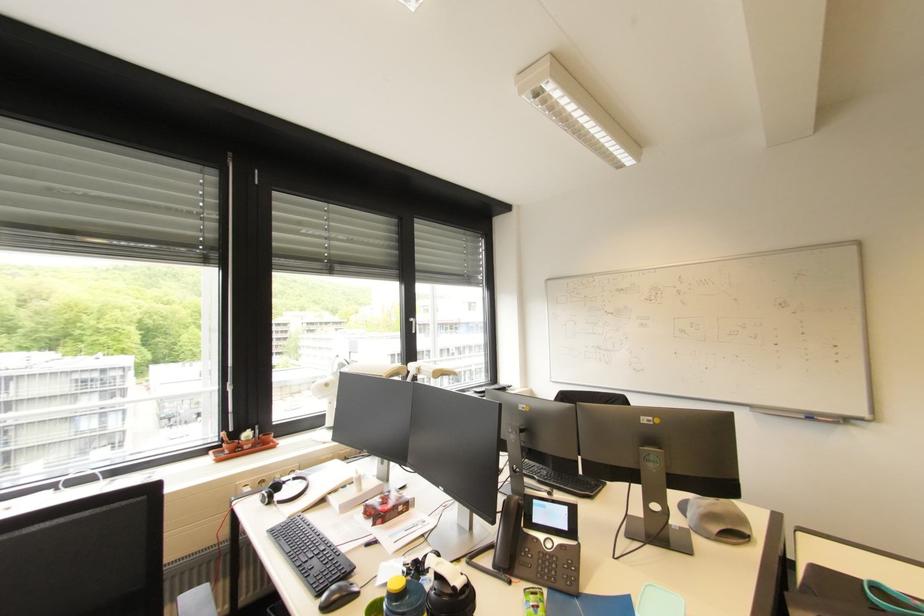
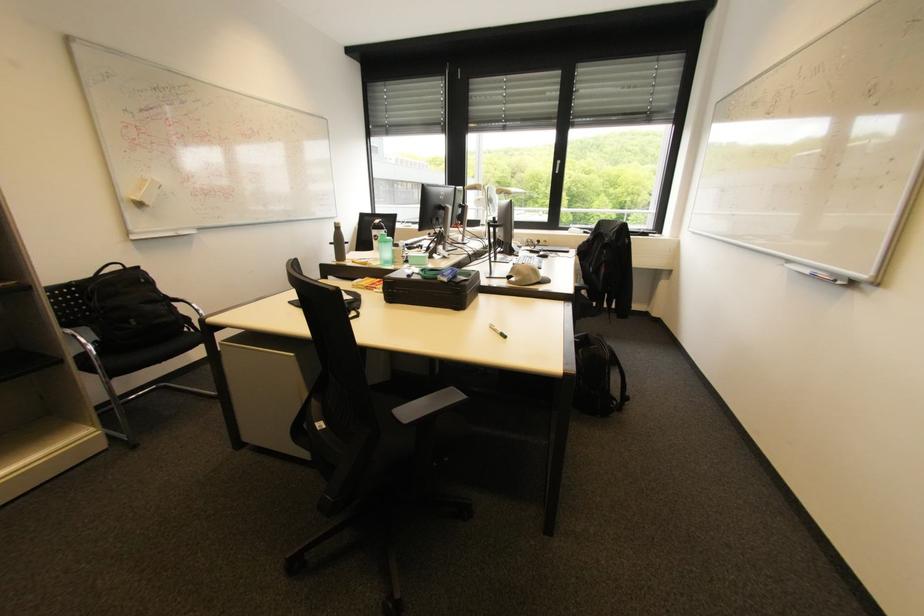
The point at (752,408) is marked in the first image. Where is the corresponding point in the second image?

(789, 262)